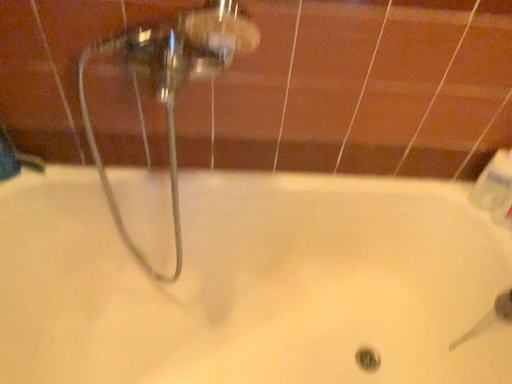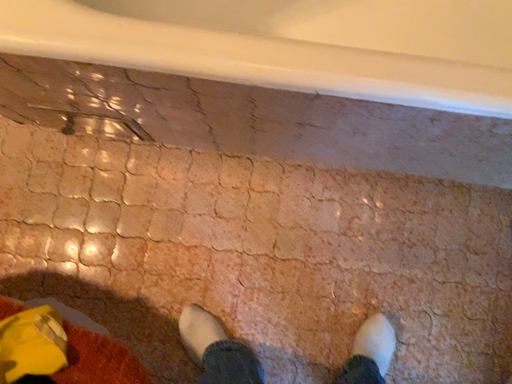
Question: Which way did the camera rotate in the video?

Choices:
 (A) rotated right
 (B) rotated left

Answer: (B)